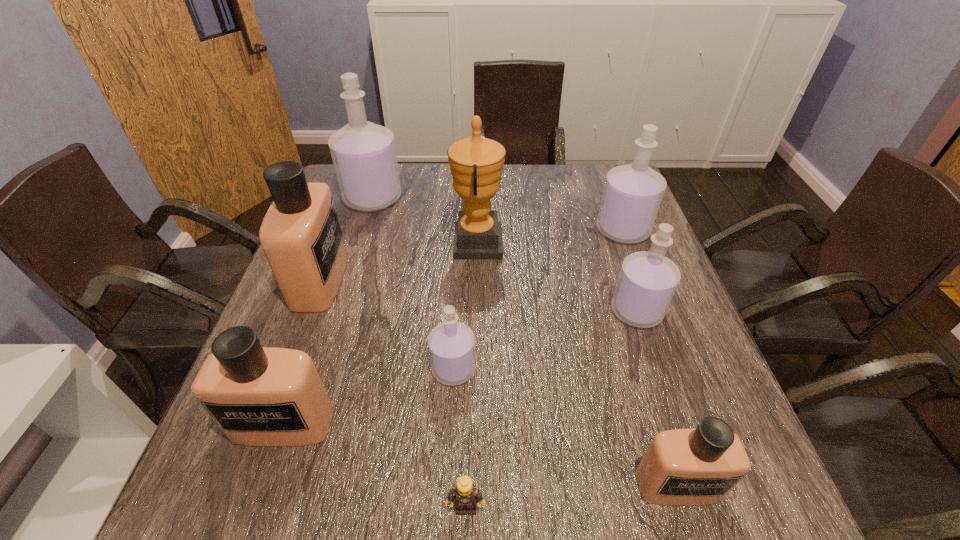
Locate an element on the screen. the tallest perfume is located at coordinates (363, 153).

I want to click on the biggest purple perfume, so click(x=363, y=153).

The image size is (960, 540). What are the coordinates of `golden award` in the screenshot? It's located at (476, 163).

Locate an element on the screen. This screenshot has width=960, height=540. the farthest beige perfume is located at coordinates (301, 236).

The height and width of the screenshot is (540, 960). Identify the location of the third smallest purple perfume. (632, 194).

This screenshot has width=960, height=540. I want to click on the second nearest purple perfume, so click(x=647, y=282).

Where is `the second nearest beige perfume`? The height and width of the screenshot is (540, 960). the second nearest beige perfume is located at coordinates (258, 396).

Locate an element on the screen. the second biggest beige perfume is located at coordinates (258, 396).

I want to click on the nearest purple perfume, so click(451, 344).

Locate an element on the screen. This screenshot has width=960, height=540. the fifth farthest perfume is located at coordinates (451, 344).